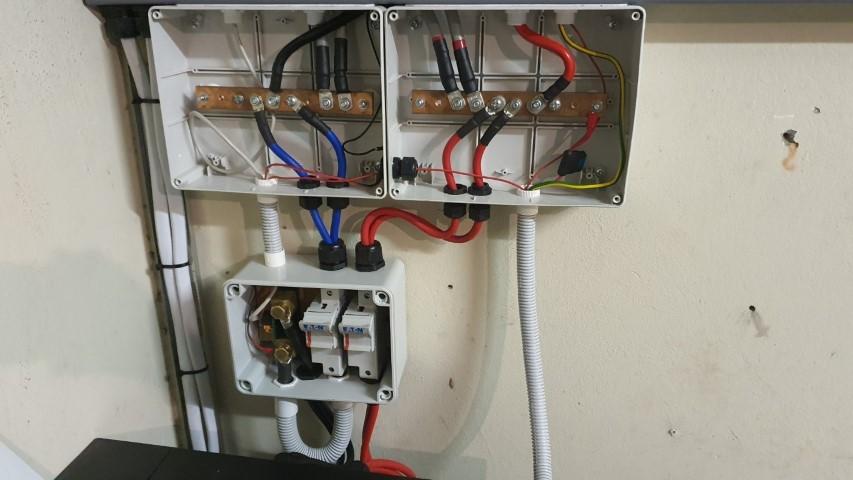
Find the location of `wires`. wires is located at coordinates (370, 236), (343, 213), (337, 176), (351, 142), (374, 424).